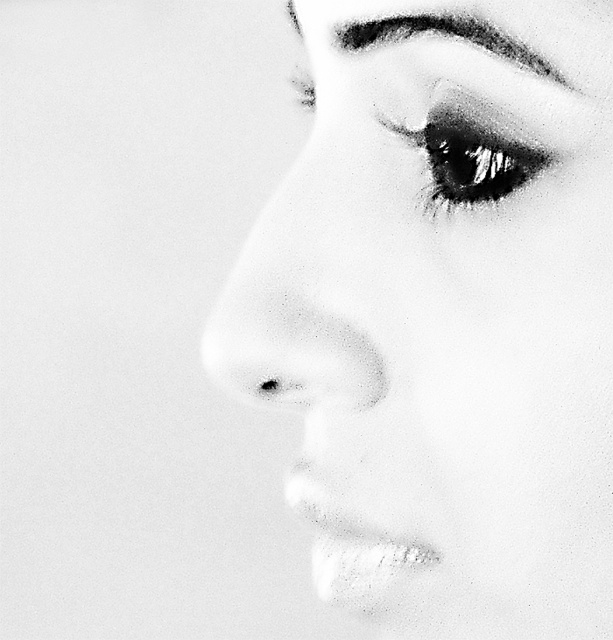
Looking at the closeup portrait, which object is located above the other between the smooth skin face at upper right and the black textured eyebrow at upper center?

The black textured eyebrow at upper center is above the smooth skin face at upper right.

Based on the scene description, which object is taller between the smooth skin face at upper right and the shiny black eye at upper right?

The smooth skin face at upper right is much taller than the shiny black eye at upper right according to the description.